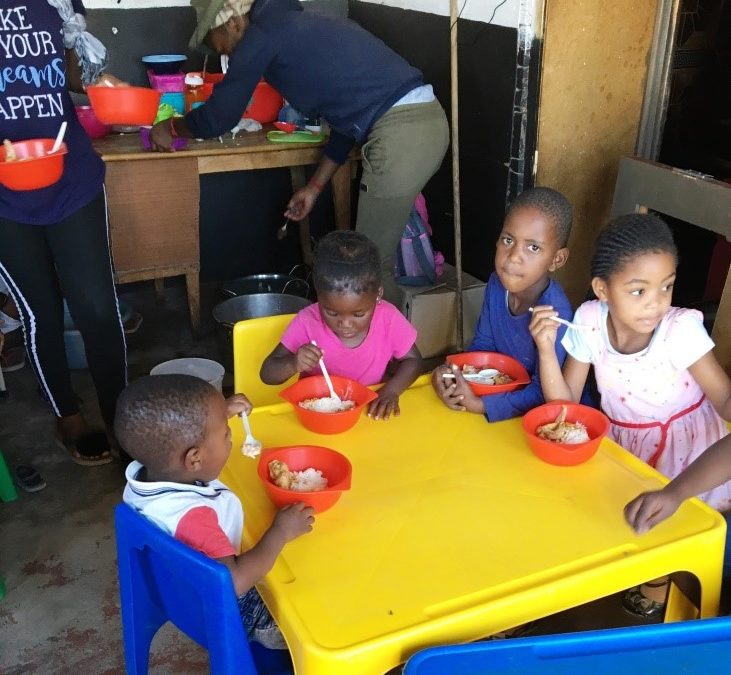
You are a GUI agent. You are given a task and a screenshot of the screen. Output one action in this format:
    pyautogui.click(x=<x>, y=<y>)
    Task: Click on the red bowl
    The height and width of the screenshot is (675, 731).
    Given the screenshot: What is the action you would take?
    pyautogui.click(x=352, y=427)